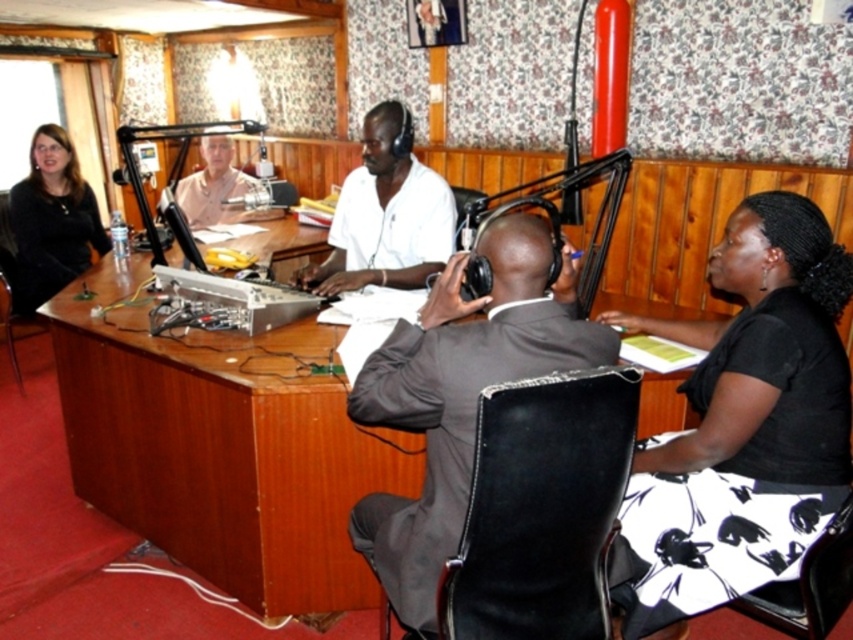
Is white matte shirt at center smaller than matte black jacket at left?

Actually, white matte shirt at center might be larger than matte black jacket at left.

Who is higher up, white matte shirt at center or matte black jacket at left?

matte black jacket at left

What do you see at coordinates (386, 214) in the screenshot?
I see `white matte shirt at center` at bounding box center [386, 214].

This screenshot has width=853, height=640. What are the coordinates of `white matte shirt at center` in the screenshot? It's located at (386, 214).

This screenshot has width=853, height=640. Describe the element at coordinates (746, 420) in the screenshot. I see `black printed skirt at lower right` at that location.

Who is positioned more to the left, black printed skirt at lower right or light brown wood desk at center?

light brown wood desk at center

Who is more forward, (x=730, y=484) or (x=207, y=147)?

Positioned in front is point (x=730, y=484).

This screenshot has height=640, width=853. In order to click on black printed skirt at lower right in this screenshot , I will do `click(746, 420)`.

How distant is dark gray suit at center from light brown wood desk at center?

dark gray suit at center is 9.46 feet away from light brown wood desk at center.

Who is more forward, [392,424] or [196,173]?

Point [392,424] is more forward.

Locate an element on the screen. dark gray suit at center is located at coordinates (461, 396).